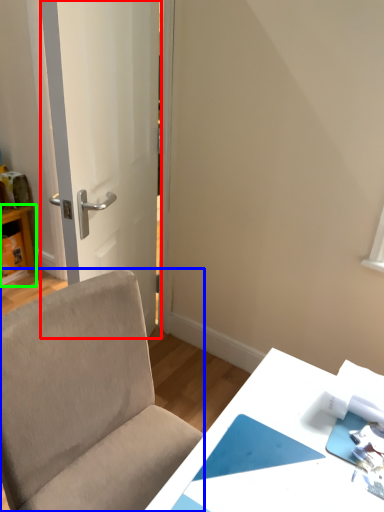
Question: Which object is the farthest from door (highlighted by a red box)? Choose among these: chair (highlighted by a blue box) or table (highlighted by a green box).

Choices:
 (A) chair
 (B) table

Answer: (B)